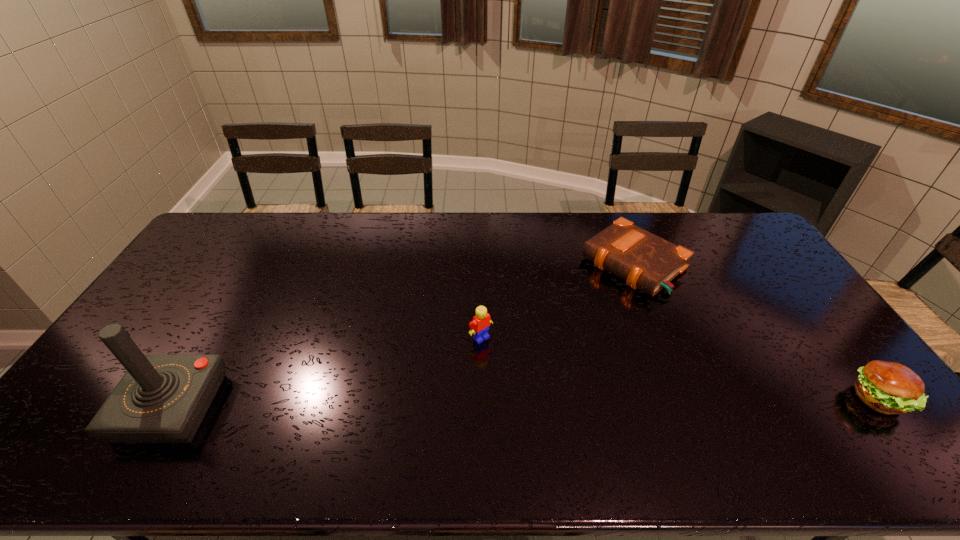
Image resolution: width=960 pixels, height=540 pixels. Find the location of `free spot located 0.300m on the front-facing side of the Lego`. free spot located 0.300m on the front-facing side of the Lego is located at coordinates (563, 419).

Find the location of `blank area located on the front-facing side of the Lego`. blank area located on the front-facing side of the Lego is located at coordinates tap(525, 381).

At what (x,y) coordinates should I click in order to perform the action: click on vacant space situated 0.270m on the front-facing side of the Lego. Please return your answer as a coordinate pair (x, y). The width and height of the screenshot is (960, 540). Looking at the image, I should click on (554, 410).

What are the coordinates of `free space located on the spine side of the Bible` in the screenshot? It's located at (526, 347).

What are the coordinates of `free region located 0.170m on the spine side of the Bible` in the screenshot? It's located at (568, 314).

This screenshot has height=540, width=960. In order to click on vacant space located 0.300m on the spine side of the Bible in this screenshot , I will do (540, 336).

Where is `object at the far edge`? This screenshot has width=960, height=540. object at the far edge is located at coordinates (645, 261).

The height and width of the screenshot is (540, 960). Find the location of `joystick that is at the near edge`. joystick that is at the near edge is located at coordinates (161, 398).

You are a GUI agent. You are given a task and a screenshot of the screen. Output one action in this format:
    pyautogui.click(x=<x>, y=<y>)
    Task: Click on the hamburger that is at the near edge
    
    Given the screenshot: What is the action you would take?
    pyautogui.click(x=887, y=387)

The width and height of the screenshot is (960, 540). Identify the location of object that is at the left edge. (161, 398).